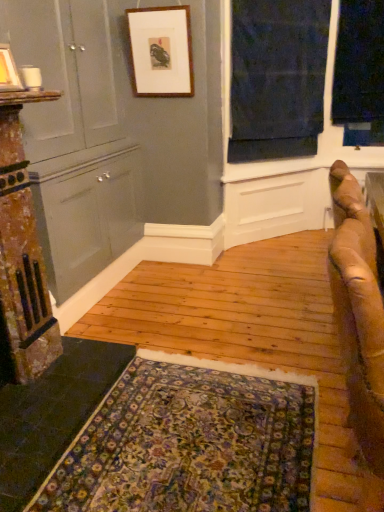
In order to face brown leather couch at right, should I rotate leftwards or rightwards?

Rotate your view right by about 20.827°.

What do you see at coordinates (358, 312) in the screenshot? The image size is (384, 512). I see `brown leather couch at right` at bounding box center [358, 312].

Locate an element on the screen. The image size is (384, 512). wooden picture frame at upper center, arranged as the 1th picture frame when viewed from the back is located at coordinates (161, 51).

Where is `matte gray dresser at left`? This screenshot has height=512, width=384. matte gray dresser at left is located at coordinates (112, 133).

Find the location of `dark blue fabric at upper right`. dark blue fabric at upper right is located at coordinates (277, 78).

Which is less distant, (x=95, y=87) or (x=372, y=462)?

Point (x=95, y=87).

Is matte gray dresser at left to the left or to the right of brown leather couch at right in the image?

From the image, it's evident that matte gray dresser at left is to the left of brown leather couch at right.

Where is `dresser located behind the brown leather couch at right`? The image size is (384, 512). dresser located behind the brown leather couch at right is located at coordinates (112, 133).

Based on the photo, from a real-world perspective, which is physically above, matte gray dresser at left or brown leather couch at right?

From a 3D spatial view, matte gray dresser at left is above.

Measure the distance from matte gray dresser at left to floral carpet at lower center.

They are 4.54 feet apart.

Is the position of matte gray dresser at left less distant than that of floral carpet at lower center?

No, it is behind floral carpet at lower center.

Does matte gray dresser at left have a smaller size compared to floral carpet at lower center?

No, matte gray dresser at left is not smaller than floral carpet at lower center.

From the image's perspective, between matte gray dresser at left and floral carpet at lower center, who is located below?

From the image's view, floral carpet at lower center is below.

Consider the image. Can you confirm if wooden picture frame at upper center, which is counted as the second picture frame, starting from the left, is bigger than dark blue fabric at upper right?

No.

Is wooden picture frame at upper center, which is counted as the second picture frame, starting from the left, positioned with its back to dark blue fabric at upper right?

No, dark blue fabric at upper right is not at the back of wooden picture frame at upper center, which is counted as the second picture frame, starting from the left.

Where is `the 2nd picture frame directly above the dark blue fabric at upper right (from a real-world perspective)`? The width and height of the screenshot is (384, 512). the 2nd picture frame directly above the dark blue fabric at upper right (from a real-world perspective) is located at coordinates (161, 51).

From the image's perspective, between floral carpet at lower center and dark blue fabric at upper right, who is located below?

floral carpet at lower center.

How different are the orientations of floral carpet at lower center and dark blue fabric at upper right in degrees?

floral carpet at lower center and dark blue fabric at upper right are facing 44.5 degrees away from each other.

From the picture: Can you confirm if floral carpet at lower center is bigger than dark blue fabric at upper right?

No, floral carpet at lower center is not bigger than dark blue fabric at upper right.

From a real-world perspective, relative to dark blue fabric at upper right, is floral carpet at lower center vertically above or below?

In terms of real-world spatial position, floral carpet at lower center is below dark blue fabric at upper right.

From a real-world perspective, which is physically above, matte white picture frame at upper left, which is the 2th picture frame from back to front, or dark blue fabric at upper right?

matte white picture frame at upper left, which is the 2th picture frame from back to front, from a real-world perspective.

At what (x,y) coordinates should I click in order to perform the action: click on window below the matte white picture frame at upper left, arranged as the 2th picture frame when viewed from the top (from a real-world perspective). Please return your answer as a coordinate pair (x, y). This screenshot has height=512, width=384. Looking at the image, I should click on (277, 78).

Is matte white picture frame at upper left, arranged as the 1th picture frame when viewed from the left, smaller than dark blue fabric at upper right?

Indeed, matte white picture frame at upper left, arranged as the 1th picture frame when viewed from the left, has a smaller size compared to dark blue fabric at upper right.

Could you tell me if wooden picture frame at upper center, the second picture frame ordered from the bottom, is facing brown leather couch at right?

No, wooden picture frame at upper center, the second picture frame ordered from the bottom, does not turn towards brown leather couch at right.

Who is more distant, wooden picture frame at upper center, which appears as the first picture frame when viewed from the top, or brown leather couch at right?

Positioned behind is wooden picture frame at upper center, which appears as the first picture frame when viewed from the top.

Can you confirm if wooden picture frame at upper center, positioned as the second picture frame in front-to-back order, is bigger than brown leather couch at right?

No, wooden picture frame at upper center, positioned as the second picture frame in front-to-back order, is not bigger than brown leather couch at right.

How different are the orientations of wooden picture frame at upper center, positioned as the second picture frame in front-to-back order, and matte gray dresser at left in degrees?

The angle between the facing direction of wooden picture frame at upper center, positioned as the second picture frame in front-to-back order, and the facing direction of matte gray dresser at left is 89.8 degrees.

Does point (138, 69) come farther from viewer compared to point (64, 179)?

Yes, point (138, 69) is farther from viewer.

From a real-world perspective, relative to matte gray dresser at left, is wooden picture frame at upper center, arranged as the 1th picture frame when viewed from the right, vertically above or below?

wooden picture frame at upper center, arranged as the 1th picture frame when viewed from the right, is above matte gray dresser at left.

In terms of size, does wooden picture frame at upper center, the second picture frame ordered from the bottom, appear bigger or smaller than matte gray dresser at left?

In the image, wooden picture frame at upper center, the second picture frame ordered from the bottom, appears to be smaller than matte gray dresser at left.

This screenshot has width=384, height=512. Find the location of `dresser above the brown leather couch at right (from a real-world perspective)`. dresser above the brown leather couch at right (from a real-world perspective) is located at coordinates (x=112, y=133).

This screenshot has height=512, width=384. I want to click on mat in front of the matte gray dresser at left, so click(x=190, y=442).

Based on their spatial positions, is matte white picture frame at upper left, the first picture frame when ordered from front to back, or floral carpet at lower center further from dark blue fabric at upper right?

floral carpet at lower center is positioned further to the anchor dark blue fabric at upper right.

Considering their positions, is floral carpet at lower center positioned further to wooden picture frame at upper center, positioned as the second picture frame in front-to-back order, than matte gray dresser at left?

floral carpet at lower center is further to wooden picture frame at upper center, positioned as the second picture frame in front-to-back order.

Estimate the real-world distances between objects in this image. Which object is closer to matte white picture frame at upper left, the first picture frame when ordered from front to back, brown leather couch at right or dark blue fabric at upper right?

brown leather couch at right is closer to matte white picture frame at upper left, the first picture frame when ordered from front to back.

Looking at the image, which one is located further to brown leather couch at right, wooden picture frame at upper center, arranged as the 1th picture frame when viewed from the back, or matte gray dresser at left?

Among the two, wooden picture frame at upper center, arranged as the 1th picture frame when viewed from the back, is located further to brown leather couch at right.

Considering their positions, is matte gray dresser at left positioned closer to matte white picture frame at upper left, arranged as the 2th picture frame when viewed from the top, than dark blue fabric at upper right?

matte gray dresser at left is positioned closer to the anchor matte white picture frame at upper left, arranged as the 2th picture frame when viewed from the top.

Considering their positions, is matte white picture frame at upper left, which is the 2th picture frame from back to front, positioned closer to matte gray dresser at left than dark blue fabric at upper right?

dark blue fabric at upper right is positioned closer to the anchor matte gray dresser at left.

When comparing their distances from brown leather couch at right, does floral carpet at lower center or dark blue fabric at upper right seem further?

The object further to brown leather couch at right is dark blue fabric at upper right.

Which object lies nearer to the anchor point wooden picture frame at upper center, arranged as the 1th picture frame when viewed from the back, brown leather couch at right or matte gray dresser at left?

matte gray dresser at left lies closer to wooden picture frame at upper center, arranged as the 1th picture frame when viewed from the back, than the other object.

You are a GUI agent. You are given a task and a screenshot of the screen. Output one action in this format:
    pyautogui.click(x=<x>, y=<y>)
    Task: Click on the dresser between matte white picture frame at upper left, which is the first picture frame in bottom-to-top order, and floral carpet at lower center from top to bottom
    Image resolution: width=384 pixels, height=512 pixels.
    Given the screenshot: What is the action you would take?
    pyautogui.click(x=112, y=133)

What are the coordinates of `picture frame between wooden picture frame at upper center, arranged as the 1th picture frame when viewed from the back, and floral carpet at lower center from top to bottom` in the screenshot? It's located at (9, 71).

At what (x,y) coordinates should I click in order to perform the action: click on dresser positioned between matte white picture frame at upper left, arranged as the 1th picture frame when viewed from the left, and wooden picture frame at upper center, positioned as the second picture frame in front-to-back order, from near to far. Please return your answer as a coordinate pair (x, y). This screenshot has height=512, width=384. Looking at the image, I should click on (112, 133).

Identify the location of dresser between wooden picture frame at upper center, arranged as the 1th picture frame when viewed from the right, and brown leather couch at right in the up-down direction. The image size is (384, 512). 112,133.